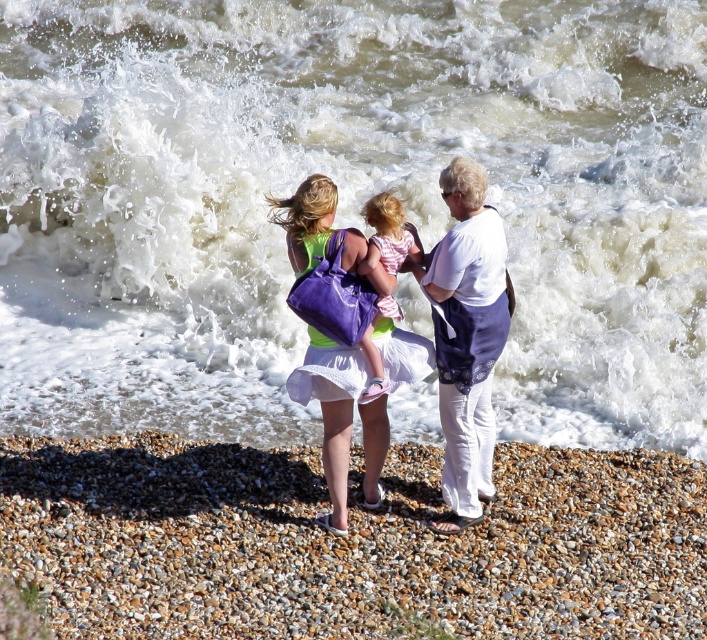
Question: Which object is closer to the camera taking this photo?

Choices:
 (A) smooth pebbles at lower center
 (B) white cotton shirt at center
 (C) white frothy water at center

Answer: (A)

Question: Which of the following is the farthest from the observer?

Choices:
 (A) pink striped dress at center
 (B) white frothy water at center
 (C) white cotton shirt at center
 (D) smooth pebbles at lower center

Answer: (B)

Question: Is white frothy water at center above white cotton shirt at center?

Choices:
 (A) yes
 (B) no

Answer: (A)

Question: Which point is farther from the camera taking this photo?

Choices:
 (A) (281, 346)
 (B) (493, 291)
 (C) (370, 330)

Answer: (A)

Question: Is smooth pebbles at lower center bigger than matte purple bag at center?

Choices:
 (A) yes
 (B) no

Answer: (A)

Question: Is matte purple bag at center below pink striped dress at center?

Choices:
 (A) no
 (B) yes

Answer: (B)